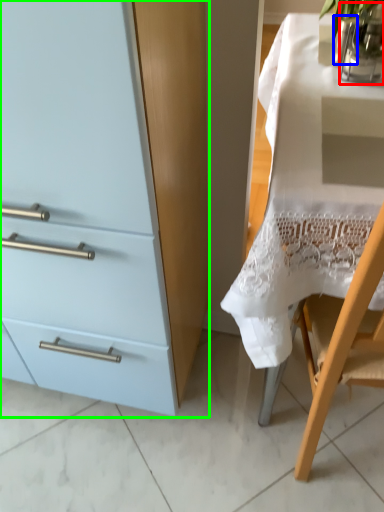
Question: Estimate the real-world distances between objects in this image. Which object is farther from glass vase (highlighted by a red box), glass vase (highlighted by a blue box) or cabinetry (highlighted by a green box)?

Choices:
 (A) glass vase
 (B) cabinetry

Answer: (B)